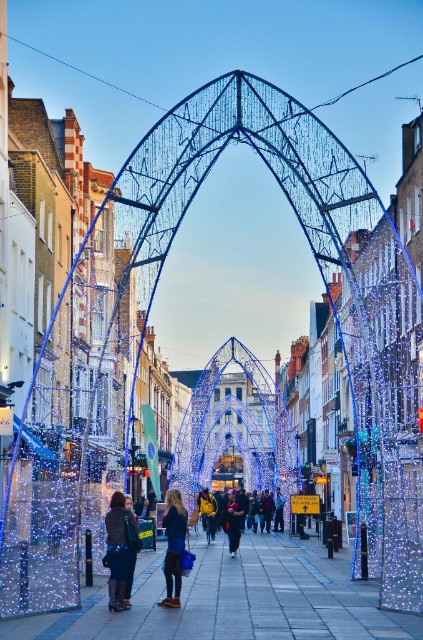
You are standing on the sidewalk and want to take a photo of the yellow fabric jacket at center and the illuminated wireframe arch at center. Which object should you focus on first to ensure both are in the frame?

The illuminated wireframe arch at center is further to the viewer than the yellow fabric jacket at center, so you should focus on the illuminated wireframe arch at center first to ensure both are in the frame.

You are a fashion designer observing the festive street scene. You notice two jackets displayed on mannequins in the image. The first is a dark brown leather jacket at lower left, and the second is a black fabric jacket at center. Which jacket appears taller in the image?

The dark brown leather jacket at lower left appears much taller than the black fabric jacket at center in the image.

You are standing at the center of the festive street scene with illuminated arches. You notice a dark brown leather jacket at lower left. Can you determine its exact position using the coordinate system provided?

The dark brown leather jacket at lower left is located at point (120, 550).